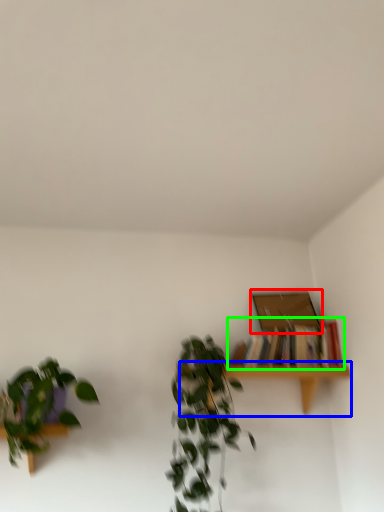
Question: Which object is positioned closest to box (highlighted by a red box)? Select from table (highlighted by a blue box) and book (highlighted by a green box).

Choices:
 (A) table
 (B) book

Answer: (B)